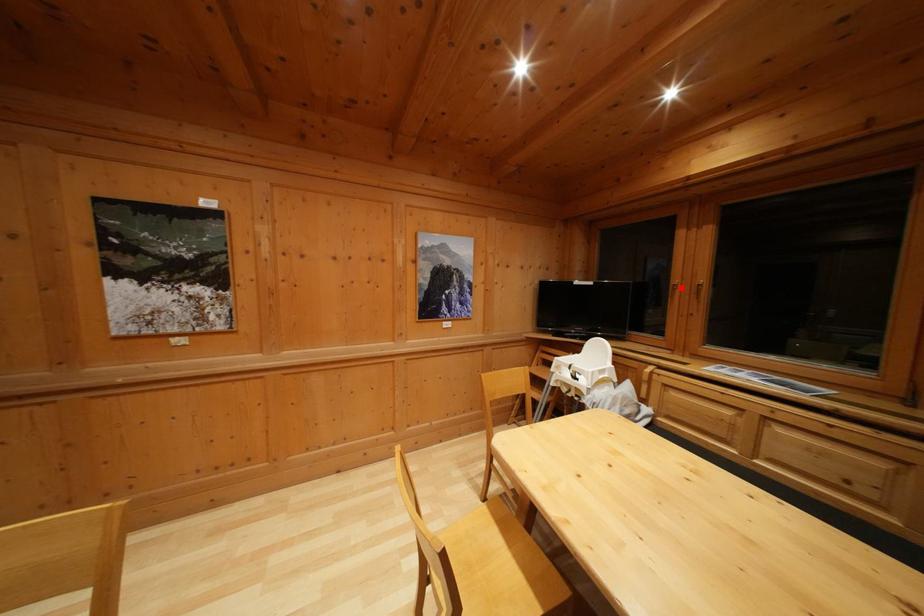
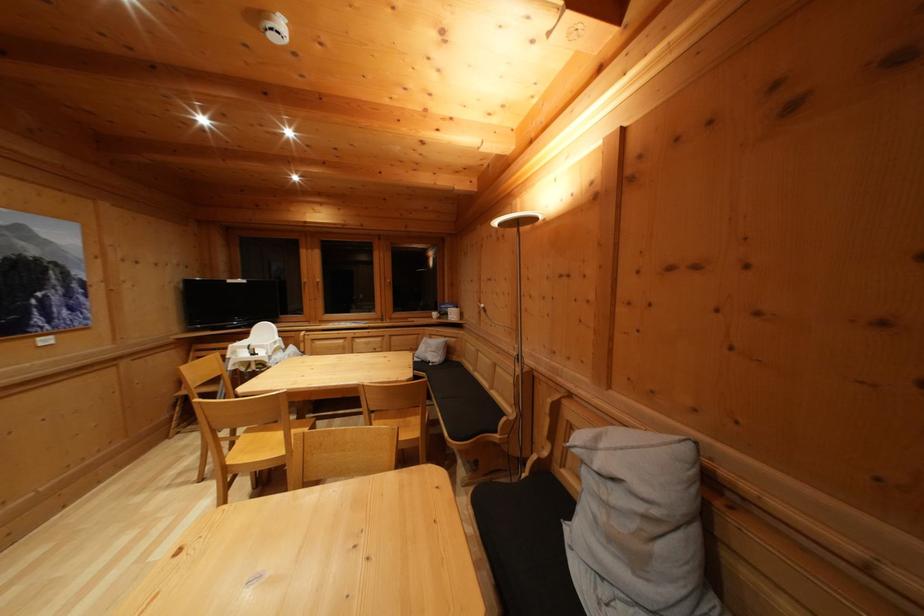
Where in the second image is the point corresponding to the highlighted location from the first image?

(310, 286)